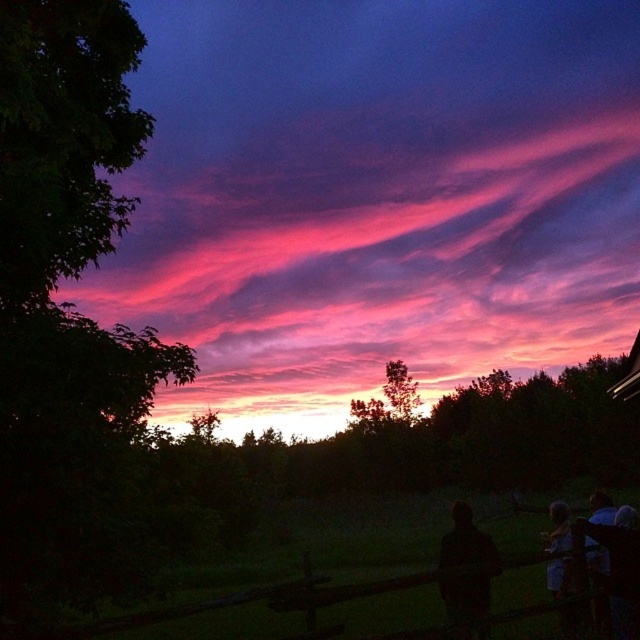
Question: Estimate the real-world distances between objects in this image. Which object is closer to the black matte person at lower right?

Choices:
 (A) dark hair at lower right
 (B) pink translucent clouds at upper center

Answer: (A)

Question: Is pink translucent clouds at upper center further to camera compared to dark hair at lower right?

Choices:
 (A) yes
 (B) no

Answer: (A)

Question: Among these objects, which one is farthest from the camera?

Choices:
 (A) dark hair at lower right
 (B) pink translucent clouds at upper center
 (C) black matte person at lower right

Answer: (B)

Question: Can you confirm if pink translucent clouds at upper center is positioned above dark hair at lower right?

Choices:
 (A) no
 (B) yes

Answer: (B)

Question: Which object is positioned farthest from the pink translucent clouds at upper center?

Choices:
 (A) black matte person at lower right
 (B) dark hair at lower right

Answer: (B)

Question: Can you confirm if pink translucent clouds at upper center is positioned to the right of black matte person at lower right?

Choices:
 (A) yes
 (B) no

Answer: (A)